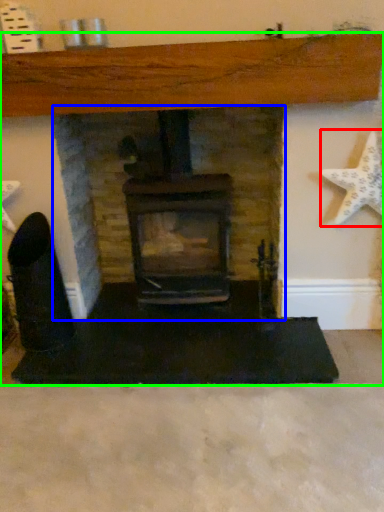
Question: Considering the real-world distances, which object is closest to starfish (highlighted by a red box)? fireplace (highlighted by a blue box) or fireplace (highlighted by a green box).

Choices:
 (A) fireplace
 (B) fireplace

Answer: (B)